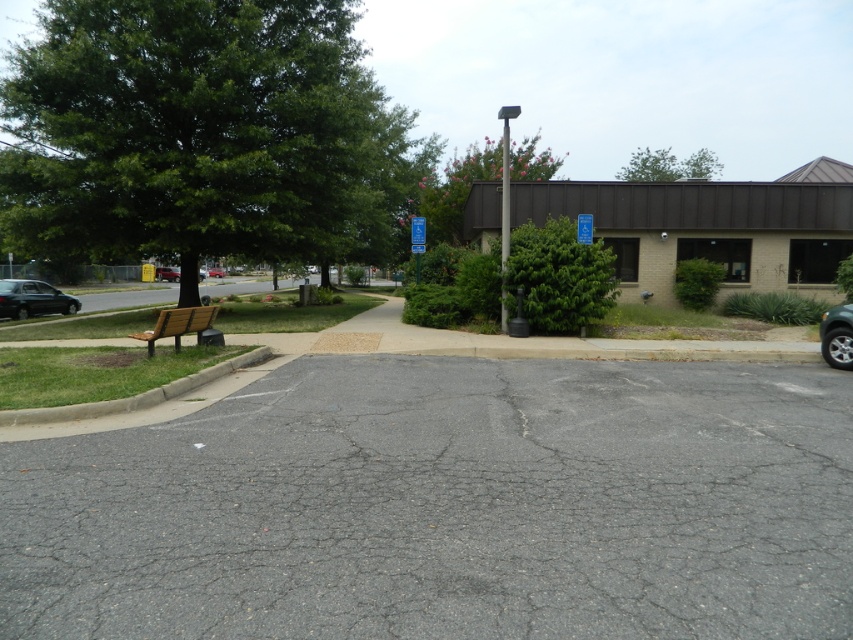
Question: Among these objects, which one is nearest to the camera?

Choices:
 (A) green concrete curb at lower left
 (B) green leafy tree at upper left

Answer: (A)

Question: Considering the relative positions of gray asphalt parking lot at center and green concrete curb at lower left in the image provided, where is gray asphalt parking lot at center located with respect to green concrete curb at lower left?

Choices:
 (A) above
 (B) below

Answer: (B)

Question: Which point is closer to the camera?

Choices:
 (A) pink textured bush at upper center
 (B) gray asphalt parking lot at center
 (C) green leafy tree at upper center

Answer: (B)

Question: Among these objects, which one is farthest from the camera?

Choices:
 (A) green leafy tree at upper left
 (B) green leafy tree at upper center
 (C) metallic red car at left
 (D) wooden bench at lower left

Answer: (C)

Question: Is silver metallic car at right in front of metallic red car at center?

Choices:
 (A) no
 (B) yes

Answer: (B)

Question: Can you confirm if green concrete curb at lower left is positioned to the left of silver metallic car at right?

Choices:
 (A) yes
 (B) no

Answer: (A)